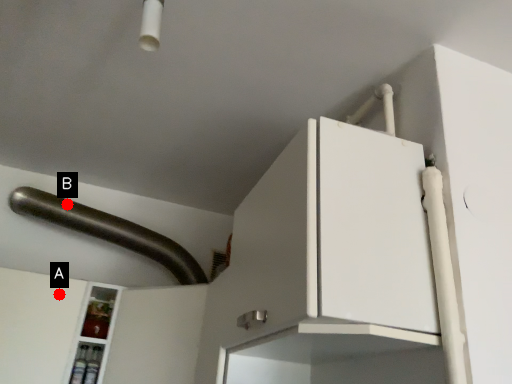
Question: Two points are circled on the image, labeled by A and B beside each circle. Which point is farther from the camera taking this photo?

Choices:
 (A) A is further
 (B) B is further

Answer: (B)